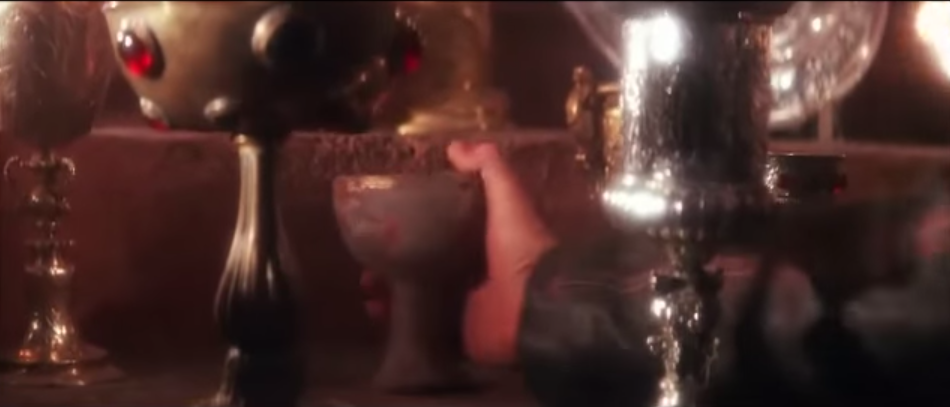
The image size is (950, 407). I want to click on goblet cups, so click(213, 42), click(52, 43), click(696, 81), click(596, 131), click(808, 176), click(414, 217).